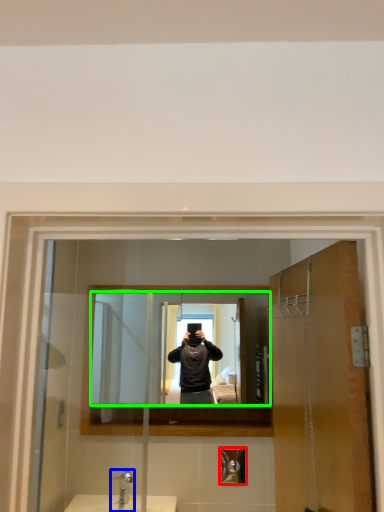
Question: Estimate the real-world distances between objects in this image. Which object is farther from shower (highlighted by a red box), tap (highlighted by a blue box) or mirror (highlighted by a green box)?

Choices:
 (A) tap
 (B) mirror

Answer: (B)